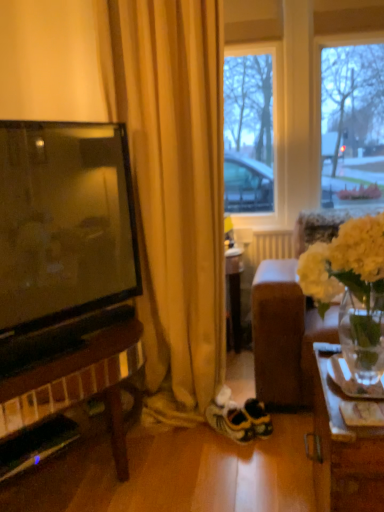
Question: Does white suede sneakers at center lie behind white fabric couch at right?

Choices:
 (A) yes
 (B) no

Answer: (A)

Question: Considering the relative sizes of white suede sneakers at center and white fabric couch at right in the image provided, is white suede sneakers at center wider than white fabric couch at right?

Choices:
 (A) no
 (B) yes

Answer: (A)

Question: Considering the relative sizes of white suede sneakers at center and white fabric couch at right in the image provided, is white suede sneakers at center bigger than white fabric couch at right?

Choices:
 (A) yes
 (B) no

Answer: (B)

Question: Is white suede sneakers at center far from white fabric couch at right?

Choices:
 (A) no
 (B) yes

Answer: (A)

Question: Is white suede sneakers at center touching white fabric couch at right?

Choices:
 (A) yes
 (B) no

Answer: (B)

Question: Is point (243, 233) closer or farther from the camera than point (314, 292)?

Choices:
 (A) farther
 (B) closer

Answer: (A)

Question: Is white matte radiator at center taller or shorter than white matte vase at right?

Choices:
 (A) tall
 (B) short

Answer: (A)

Question: Relative to white matte vase at right, is white matte radiator at center in front or behind?

Choices:
 (A) behind
 (B) front

Answer: (A)

Question: From a real-world perspective, is white matte radiator at center above or below white matte vase at right?

Choices:
 (A) below
 (B) above

Answer: (A)

Question: Considering their positions, is white matte radiator at center located in front of or behind white fabric couch at right?

Choices:
 (A) front
 (B) behind

Answer: (B)

Question: Does point (244, 248) appear closer or farther from the camera than point (294, 295)?

Choices:
 (A) farther
 (B) closer

Answer: (A)

Question: From a real-world perspective, is white matte radiator at center above or below white fabric couch at right?

Choices:
 (A) below
 (B) above

Answer: (A)

Question: From their relative heights in the image, would you say white matte radiator at center is taller or shorter than white fabric couch at right?

Choices:
 (A) short
 (B) tall

Answer: (A)

Question: Is white fabric couch at right in front of or behind white matte radiator at center in the image?

Choices:
 (A) behind
 (B) front

Answer: (B)

Question: In terms of size, does white fabric couch at right appear bigger or smaller than white matte radiator at center?

Choices:
 (A) small
 (B) big

Answer: (B)